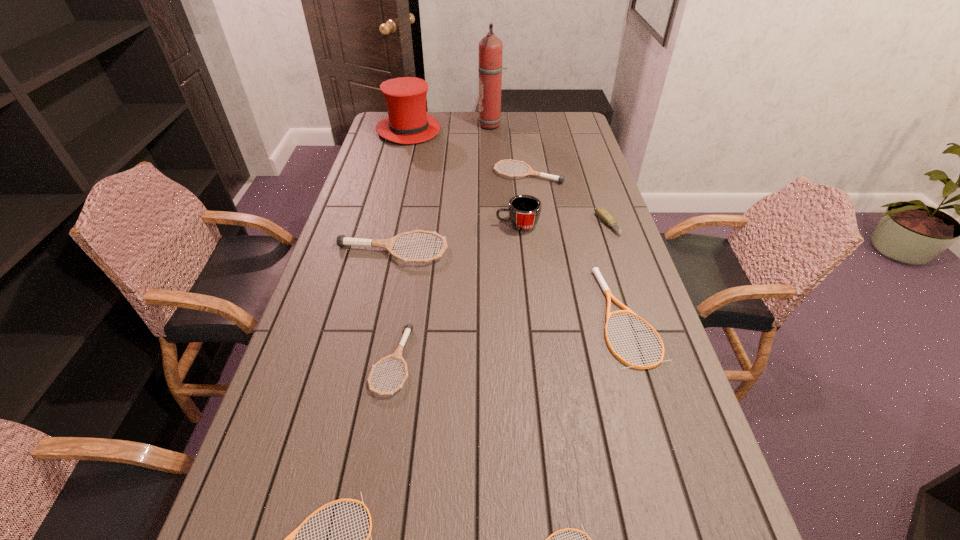
In order to click on vacant space located on the side of the mug with the handle in this screenshot , I will do `click(435, 225)`.

Where is `vacant space located 0.100m on the side of the mug with the handle`? vacant space located 0.100m on the side of the mug with the handle is located at coordinates (466, 225).

Locate an element on the screen. blank area located on the front of the biggest gray tennis racket is located at coordinates (373, 339).

Where is `vacant space located 0.080m on the back of the rightmost gray tennis racket`? This screenshot has width=960, height=540. vacant space located 0.080m on the back of the rightmost gray tennis racket is located at coordinates (524, 153).

You are a GUI agent. You are given a task and a screenshot of the screen. Output one action in this format:
    pyautogui.click(x=<x>, y=<y>)
    Task: Click on the vacant area situated 0.400m on the left of the pocketknife
    The image size is (960, 540).
    Given the screenshot: What is the action you would take?
    pyautogui.click(x=477, y=225)

I want to click on vacant position located on the back of the smallest gray tennis racket, so click(411, 253).

The width and height of the screenshot is (960, 540). Identify the location of blank space located 0.110m on the front of the third shortest object. (657, 413).

Locate an element on the screen. The width and height of the screenshot is (960, 540). fire extinguisher at the far edge is located at coordinates (490, 67).

Find the location of `hat that is at the far edge`. hat that is at the far edge is located at coordinates pos(408,122).

Locate an element on the screen. This screenshot has height=540, width=960. hat that is at the left edge is located at coordinates (408, 122).